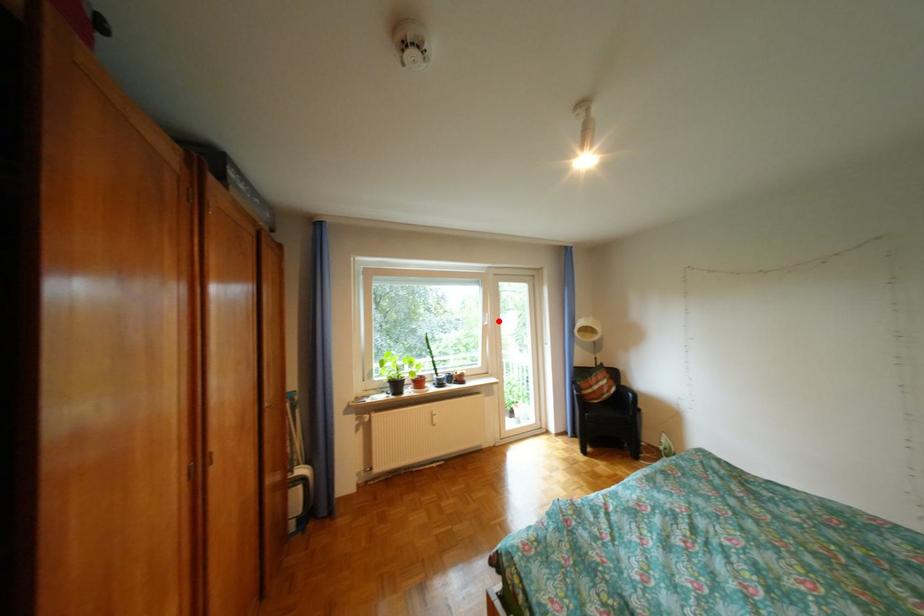
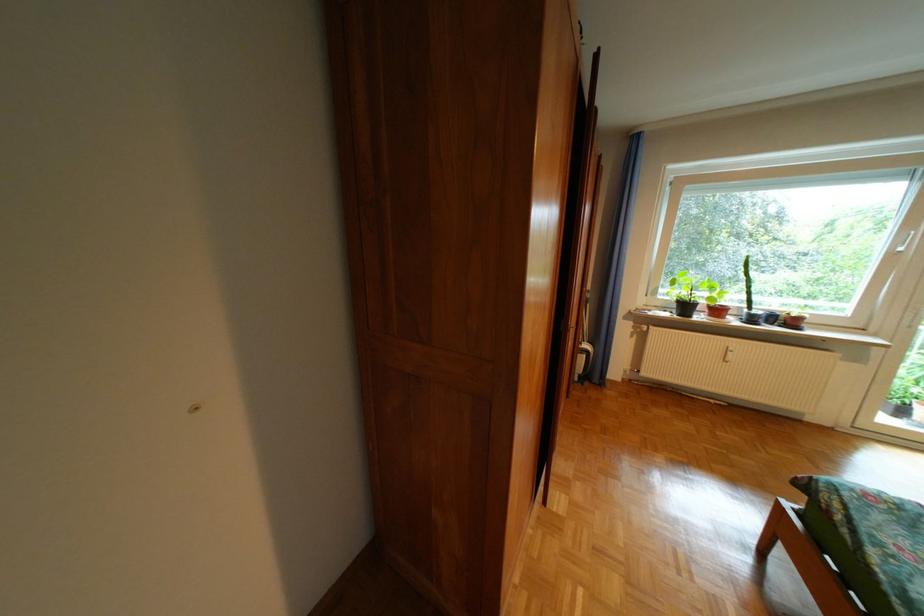
Locate, in the second image, the point that corresponds to the highlighted location in the first image.

(912, 245)